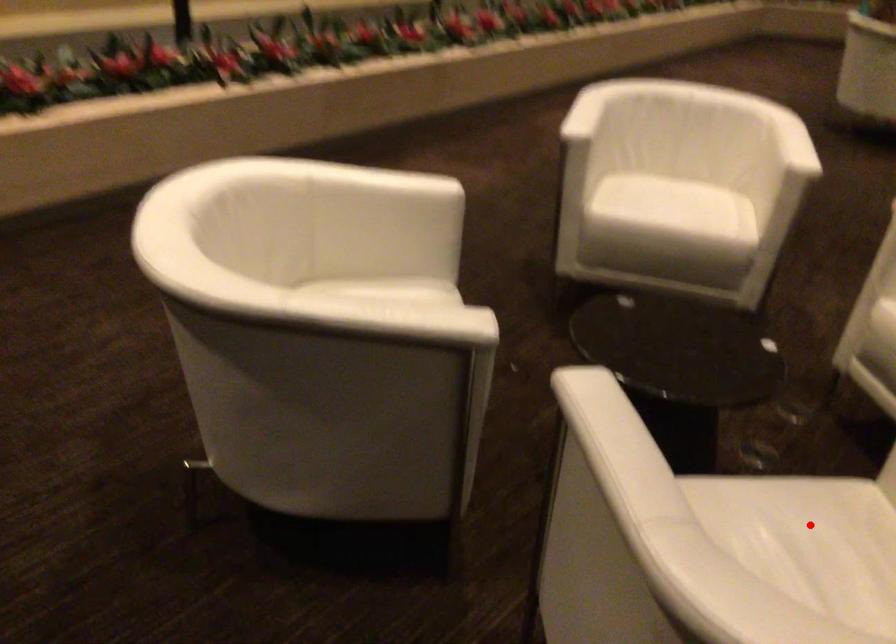
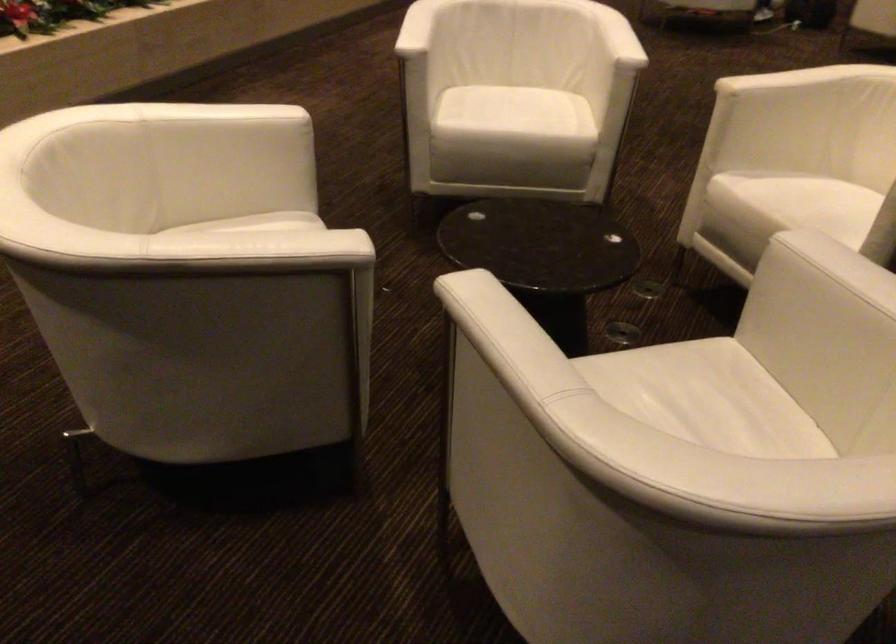
The point at the highlighted location is marked in the first image. Where is the corresponding point in the second image?

(686, 388)